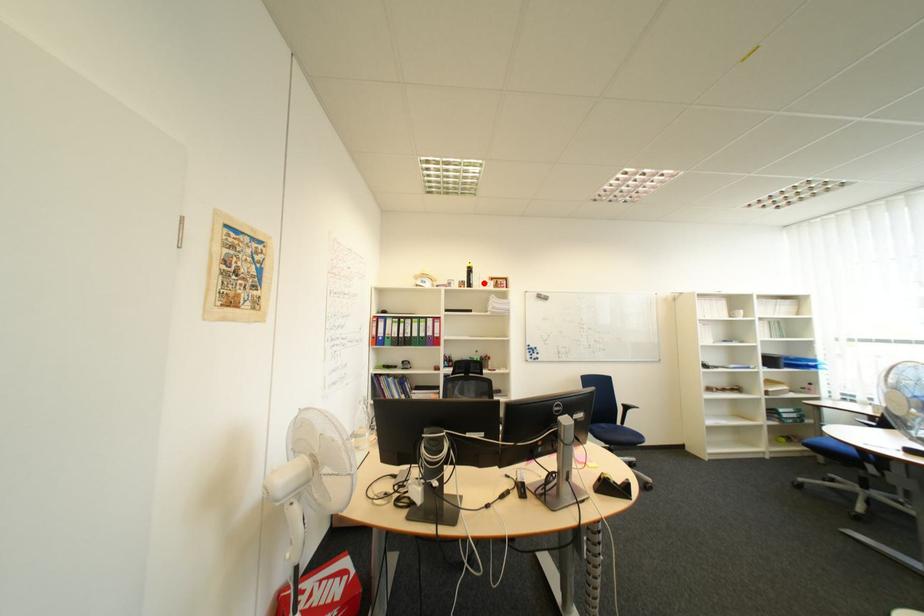
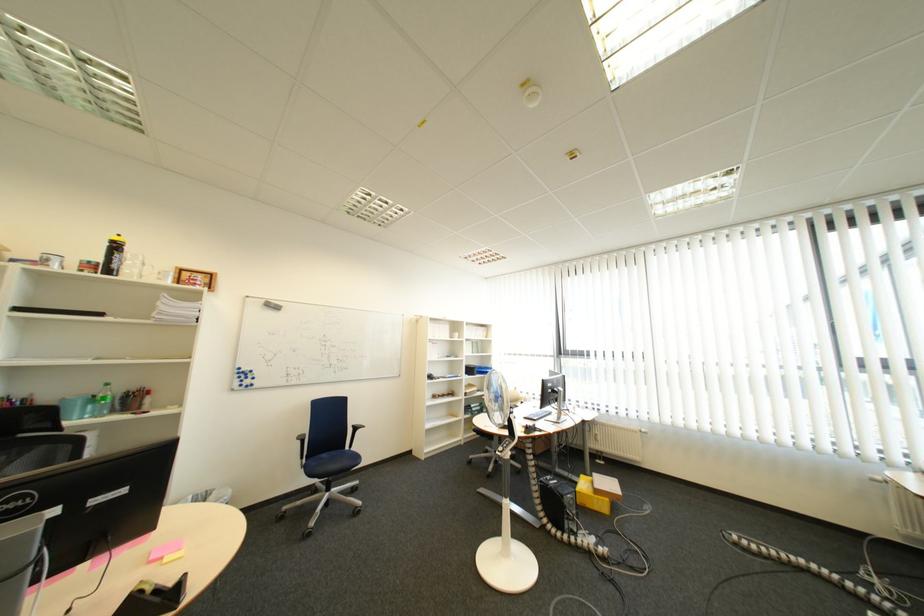
The point at the highlighted location is marked in the first image. Where is the corresponding point in the second image?

(128, 267)